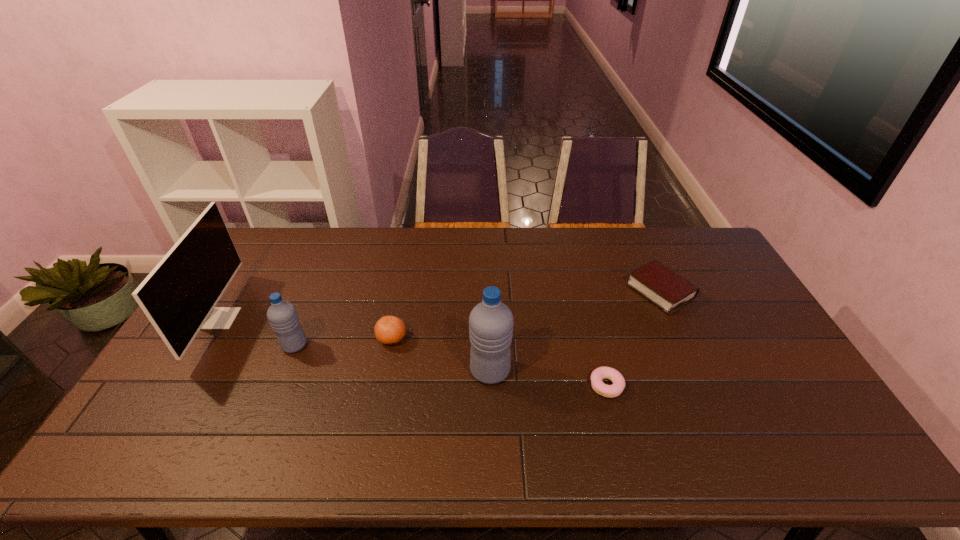
The height and width of the screenshot is (540, 960). Identify the location of vacant area at the near edge. (479, 397).

This screenshot has height=540, width=960. I want to click on vacant space at the left edge, so click(x=250, y=279).

At what (x,y) coordinates should I click in order to perform the action: click on vacant space at the right edge of the desktop. Please return your answer as a coordinate pair (x, y). Image resolution: width=960 pixels, height=540 pixels. Looking at the image, I should click on (779, 344).

This screenshot has width=960, height=540. Identify the location of free space at the near left corner. (171, 415).

Identify the location of vacant space at the far right corner of the desktop. This screenshot has width=960, height=540. (665, 232).

This screenshot has width=960, height=540. In order to click on vacant space that's between the leftmost object and the fourth shortest object in this screenshot , I will do `click(257, 332)`.

Where is `vacant area that lies between the Bible and the monitor`? The width and height of the screenshot is (960, 540). vacant area that lies between the Bible and the monitor is located at coordinates (440, 305).

The width and height of the screenshot is (960, 540). Find the location of `vacant area between the shortest object and the Bible`. vacant area between the shortest object and the Bible is located at coordinates (634, 339).

The image size is (960, 540). I want to click on free spot between the fourth shortest object and the clementine, so tap(343, 342).

I want to click on free area in between the clementine and the monitor, so click(306, 328).